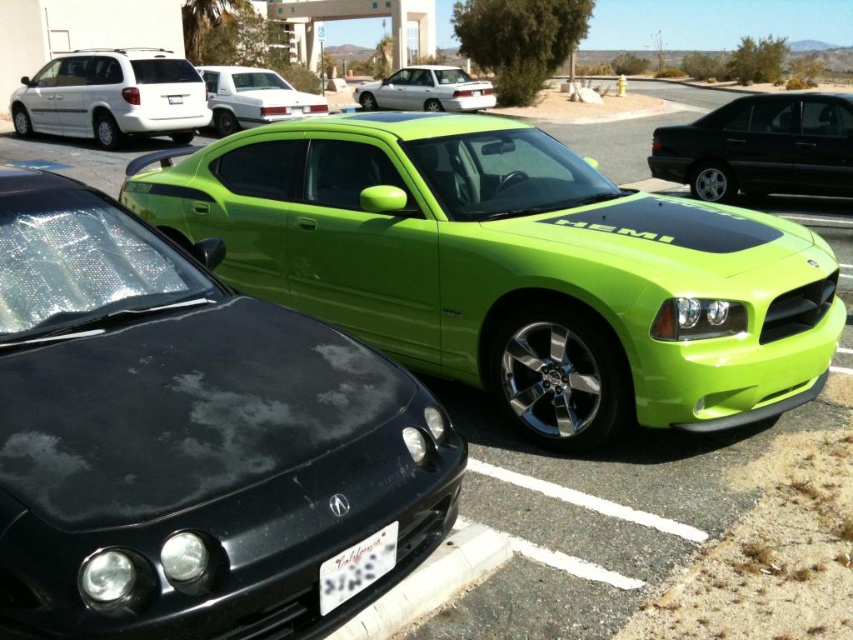
You are a delivery person trying to park your van in the parking lot. You see the lime green matte car at center and the white plastic license plate at lower center. Which object would block your path if you try to drive forward?

The lime green matte car at center would block your path because it is larger in size than the white plastic license plate at lower center.

You are standing at the entrance of the parking lot and see two points marked in the scene. The first point is at coordinate point(x=103, y=92) and the second is at point(x=462, y=77). Which point is closer to you?

Point(x=103, y=92) is in front of point(x=462, y=77), so it is closer to you.

Looking at this image, you are standing in the parking lot and want to locate two specific points in the image. The first point is at coordinates point (456,461) and the second is at point (770,288). Which point is closer to you?

Point (456,461) is closer to the viewer than point (770,288).